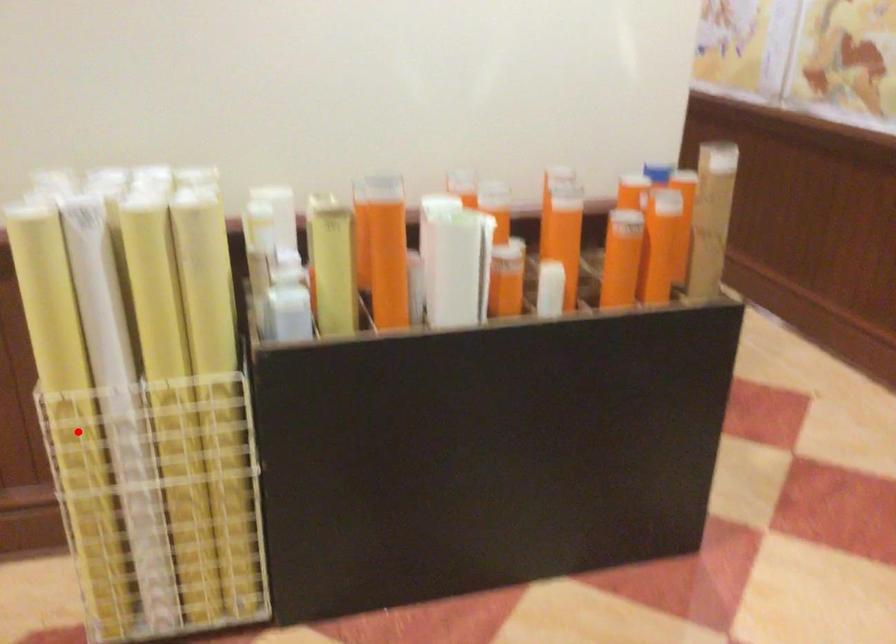
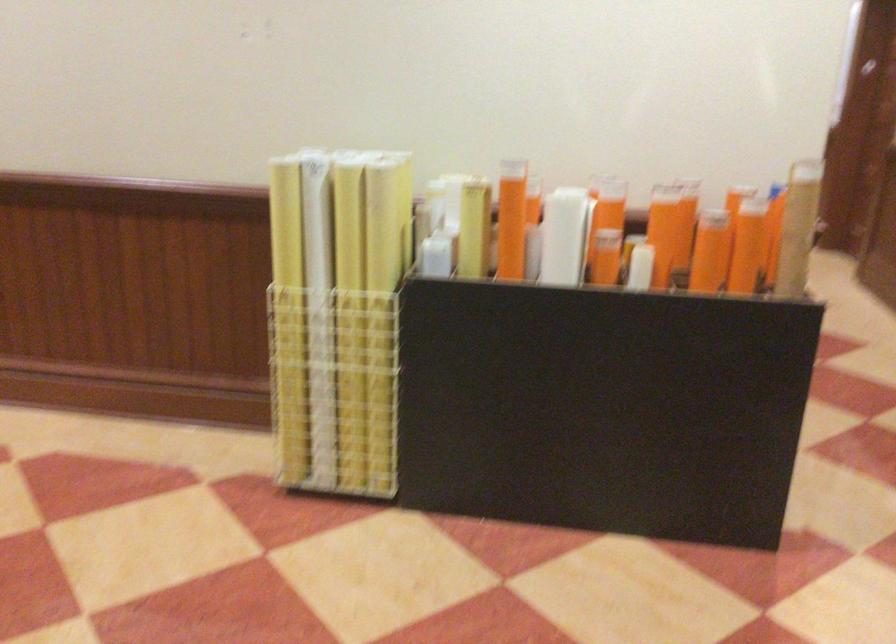
Question: I am providing you with two images of the same scene from different viewpoints. A red point is shown in image1. For the corresponding object point in image2, is it positioned nearer or farther from the camera?

Choices:
 (A) Nearer
 (B) Farther

Answer: (B)